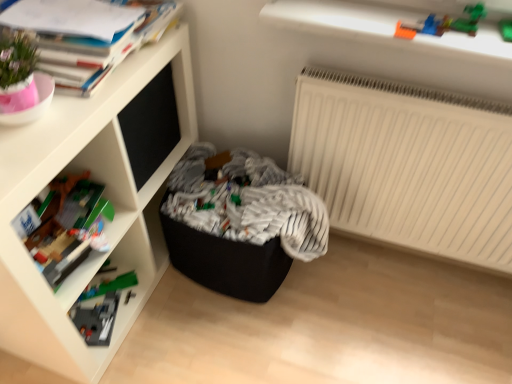
Question: Relative to black fabric laundry at center, is white matte shelf at upper left in front or behind?

Choices:
 (A) behind
 (B) front

Answer: (B)

Question: From the image's perspective, is white matte shelf at upper left above or below black fabric laundry at center?

Choices:
 (A) below
 (B) above

Answer: (B)

Question: Which of these objects is positioned closest to the white matte shelf at upper left?

Choices:
 (A) black fabric laundry at center
 (B) matte paper book at upper left
 (C) white matte radiator at upper right

Answer: (B)

Question: Which is farther from the matte paper book at upper left?

Choices:
 (A) white matte radiator at upper right
 (B) white matte shelf at upper left
 (C) black fabric laundry at center

Answer: (A)